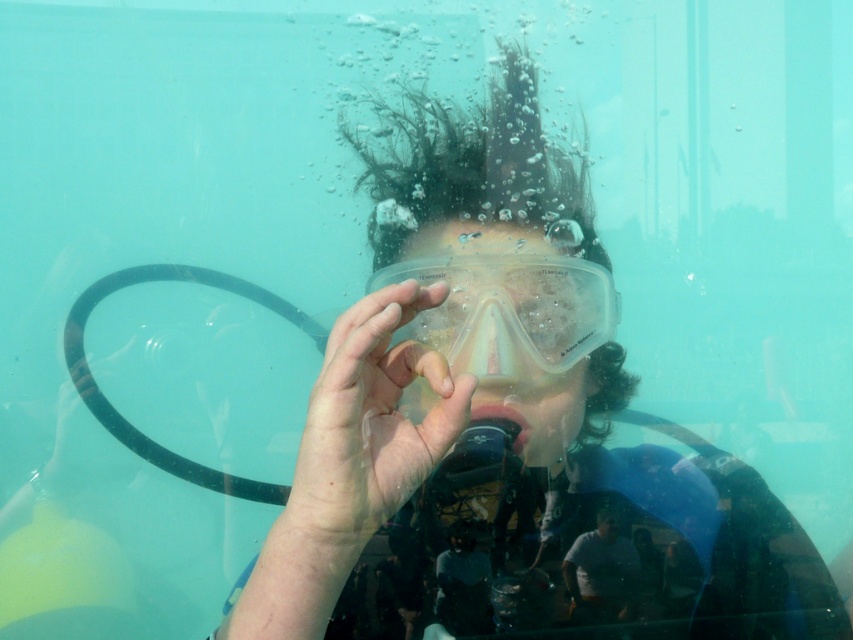
Between transparent plastic goggles at center and gray matte shirt at center, which one is positioned higher?

Positioned higher is transparent plastic goggles at center.

Is transparent plastic goggles at center bigger than gray matte shirt at center?

Indeed, transparent plastic goggles at center has a larger size compared to gray matte shirt at center.

Which is in front, point (556, 371) or point (616, 528)?

Positioned in front is point (556, 371).

Identify the location of transparent plastic goggles at center. (511, 312).

Which is more to the left, transparent plastic hand at center or gray matte shirt at center?

transparent plastic hand at center

Is transparent plastic hand at center behind gray matte shirt at center?

No, transparent plastic hand at center is closer to the viewer.

At what (x,y) coordinates should I click in order to perform the action: click on transparent plastic hand at center. Please return your answer as a coordinate pair (x, y). The width and height of the screenshot is (853, 640). Looking at the image, I should click on (368, 426).

Image resolution: width=853 pixels, height=640 pixels. What do you see at coordinates (368, 426) in the screenshot?
I see `transparent plastic hand at center` at bounding box center [368, 426].

Is point (357, 308) closer to camera compared to point (375, 289)?

Yes, point (357, 308) is in front of point (375, 289).

The width and height of the screenshot is (853, 640). Find the location of `transparent plastic hand at center`. transparent plastic hand at center is located at coordinates (368, 426).